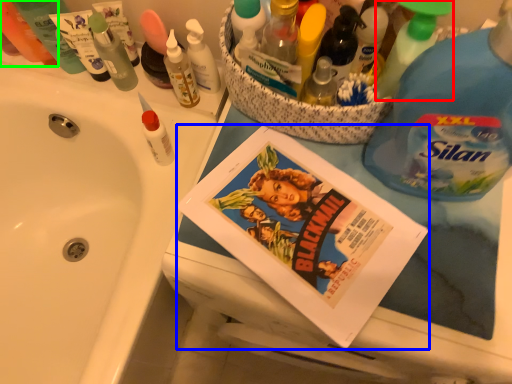
Question: Based on their relative distances, which object is nearer to cleaning product (highlighted by a red box)? Choose from comic book (highlighted by a blue box) and toiletry (highlighted by a green box).

Choices:
 (A) comic book
 (B) toiletry

Answer: (A)